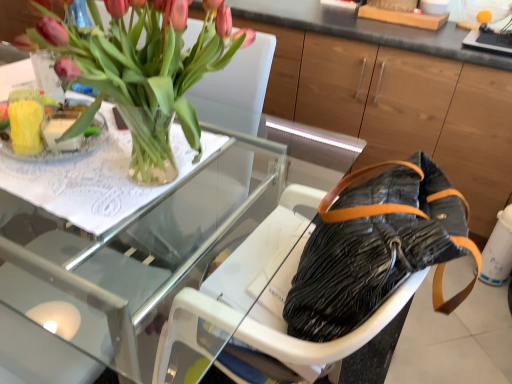
Question: Is black fabric armchair at center not inside transparent glass table at upper left?

Choices:
 (A) yes
 (B) no

Answer: (B)

Question: Is transparent glass table at upper left surrounded by black fabric armchair at center?

Choices:
 (A) yes
 (B) no

Answer: (B)

Question: Is black fabric armchair at center smaller than transparent glass table at upper left?

Choices:
 (A) no
 (B) yes

Answer: (B)

Question: Does black fabric armchair at center lie behind transparent glass table at upper left?

Choices:
 (A) yes
 (B) no

Answer: (A)

Question: Considering the relative sizes of black fabric armchair at center and transparent glass table at upper left in the image provided, is black fabric armchair at center thinner than transparent glass table at upper left?

Choices:
 (A) yes
 (B) no

Answer: (A)

Question: In the image, is leather handbag at center positioned in front of or behind clear glass vase at upper left?

Choices:
 (A) front
 (B) behind

Answer: (A)

Question: From the image's perspective, is leather handbag at center above or below clear glass vase at upper left?

Choices:
 (A) below
 (B) above

Answer: (A)

Question: Based on their positions, is leather handbag at center located to the left or right of clear glass vase at upper left?

Choices:
 (A) left
 (B) right

Answer: (B)

Question: Considering the positions of leather handbag at center and clear glass vase at upper left in the image, is leather handbag at center taller or shorter than clear glass vase at upper left?

Choices:
 (A) short
 (B) tall

Answer: (B)

Question: Which is correct: pink matte tulips at upper left is inside leather handbag at center, or outside of it?

Choices:
 (A) inside
 (B) outside

Answer: (B)

Question: Is pink matte tulips at upper left bigger or smaller than leather handbag at center?

Choices:
 (A) small
 (B) big

Answer: (B)

Question: Looking at their shapes, would you say pink matte tulips at upper left is wider or thinner than leather handbag at center?

Choices:
 (A) thin
 (B) wide

Answer: (B)

Question: From their relative heights in the image, would you say pink matte tulips at upper left is taller or shorter than leather handbag at center?

Choices:
 (A) tall
 (B) short

Answer: (A)

Question: From a real-world perspective, relative to transparent glass table at upper left, is pink matte tulips at upper left vertically above or below?

Choices:
 (A) above
 (B) below

Answer: (A)

Question: In terms of size, does pink matte tulips at upper left appear bigger or smaller than transparent glass table at upper left?

Choices:
 (A) small
 (B) big

Answer: (A)